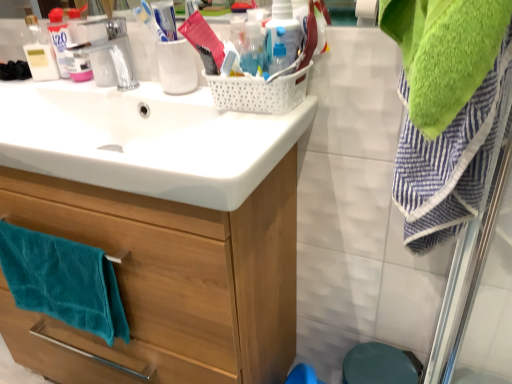
Question: Is white glossy sink at upper center positioned beyond the bounds of wooden cabinet at center?

Choices:
 (A) yes
 (B) no

Answer: (A)

Question: Does white glossy sink at upper center have a larger size compared to wooden cabinet at center?

Choices:
 (A) yes
 (B) no

Answer: (B)

Question: Is wooden cabinet at center inside white glossy sink at upper center?

Choices:
 (A) yes
 (B) no

Answer: (B)

Question: Considering the relative positions of white glossy sink at upper center and wooden cabinet at center in the image provided, is white glossy sink at upper center behind wooden cabinet at center?

Choices:
 (A) yes
 (B) no

Answer: (B)

Question: Is white glossy sink at upper center wider than wooden cabinet at center?

Choices:
 (A) no
 (B) yes

Answer: (A)

Question: Could you tell me if white glossy sink at upper center is turned towards wooden cabinet at center?

Choices:
 (A) no
 (B) yes

Answer: (A)

Question: Does teal soft towel at lower left come behind translucent plastic bottle at upper center, placed as the second bottle when sorted from left to right?

Choices:
 (A) no
 (B) yes

Answer: (B)

Question: Can translucent plastic bottle at upper center, placed as the second bottle when sorted from left to right, be found inside teal soft towel at lower left?

Choices:
 (A) no
 (B) yes

Answer: (A)

Question: Can you confirm if teal soft towel at lower left is wider than translucent plastic bottle at upper center, placed as the second bottle when sorted from left to right?

Choices:
 (A) no
 (B) yes

Answer: (B)

Question: Is teal soft towel at lower left aimed at translucent plastic bottle at upper center, the 1th bottle from the right?

Choices:
 (A) no
 (B) yes

Answer: (A)

Question: Considering the relative sizes of teal soft towel at lower left and translucent plastic bottle at upper center, placed as the second bottle when sorted from left to right, in the image provided, is teal soft towel at lower left shorter than translucent plastic bottle at upper center, placed as the second bottle when sorted from left to right,?

Choices:
 (A) no
 (B) yes

Answer: (A)

Question: From a real-world perspective, does teal soft towel at lower left stand above translucent plastic bottle at upper center, the 1th bottle from the right?

Choices:
 (A) no
 (B) yes

Answer: (A)

Question: From the image's perspective, is teal soft towel at lower left under translucent plastic bottle at upper center, which is the first bottle in left-to-right order?

Choices:
 (A) yes
 (B) no

Answer: (A)